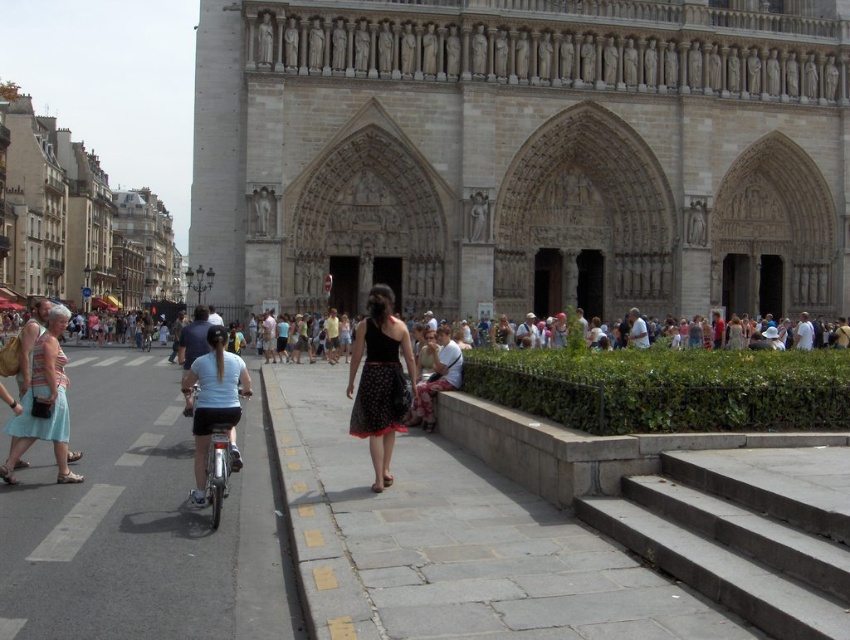
Question: From the image, what is the correct spatial relationship of gray concrete stairs at lower right in relation to light blue cotton dress at left?

Choices:
 (A) above
 (B) below

Answer: (B)

Question: Which object is positioned closest to the light blue cotton dress at left?

Choices:
 (A) gray concrete stairs at lower right
 (B) black dotted skirt at center

Answer: (B)

Question: Among these objects, which one is nearest to the camera?

Choices:
 (A) gray concrete stairs at lower right
 (B) white asphalt at lower left

Answer: (A)

Question: Is stone gothic cathedral at center positioned behind gray concrete stairs at lower right?

Choices:
 (A) yes
 (B) no

Answer: (A)

Question: Does gray concrete stairs at lower right appear under white matte bicycle at center-left?

Choices:
 (A) yes
 (B) no

Answer: (A)

Question: Estimate the real-world distances between objects in this image. Which object is closer to the black dotted skirt at center?

Choices:
 (A) stone gothic cathedral at center
 (B) white matte bicycle at center-left

Answer: (B)